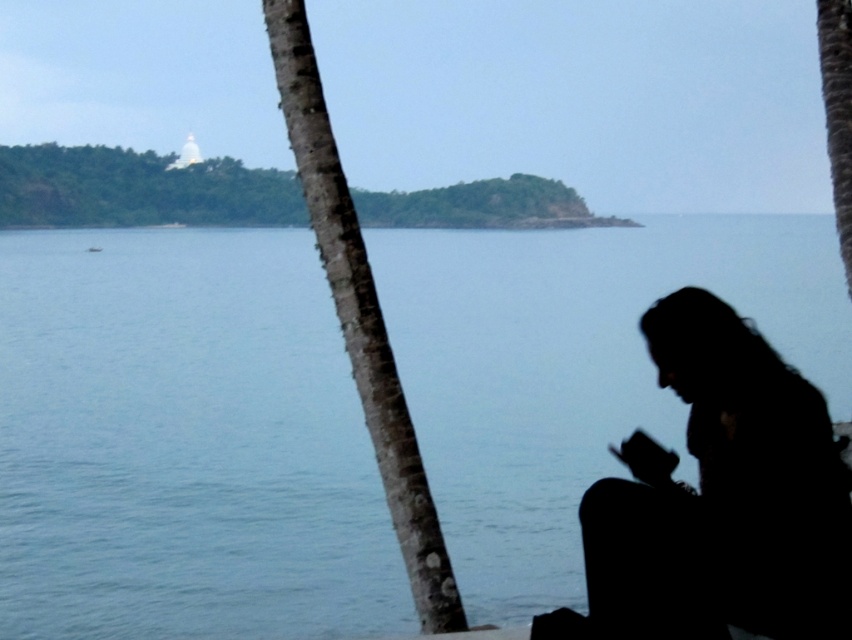
You are standing at the edge of the water and want to place a 2 meter long floating dock. Can you fit it entirely within the blue water at center?

The blue water at center is 4.49 meters from viewer. Since the dock is 2 meters long, it can fit entirely within the blue water at center as 4.49 meters is greater than 2 meters.